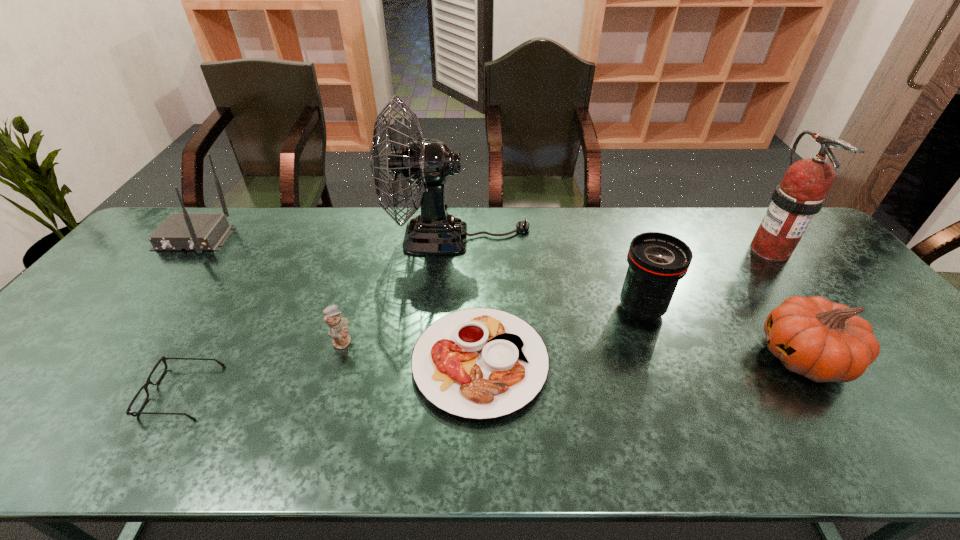
Identify the location of object that is positioned at the far right corner. Image resolution: width=960 pixels, height=540 pixels. (801, 194).

In the image, there is a desktop. Where is `free space at the far edge`? This screenshot has height=540, width=960. free space at the far edge is located at coordinates (625, 218).

Locate an element on the screen. free region at the near edge of the desktop is located at coordinates (503, 441).

Locate an element on the screen. The height and width of the screenshot is (540, 960). vacant space at the right edge of the desktop is located at coordinates (906, 410).

Locate an element on the screen. The height and width of the screenshot is (540, 960). vacant area at the far right corner is located at coordinates (818, 244).

Find the location of a particular element. Image resolution: width=960 pixels, height=540 pixels. vacant space that is in between the spectacles and the leftmost object is located at coordinates (188, 315).

Where is `vacant point located between the spectacles and the router`? The height and width of the screenshot is (540, 960). vacant point located between the spectacles and the router is located at coordinates (188, 315).

Find the location of a particular element. Image resolution: width=960 pixels, height=540 pixels. free space between the sixth object from left to right and the seventh object from right to left is located at coordinates (412, 350).

Image resolution: width=960 pixels, height=540 pixels. What are the coordinates of `vacant point located between the third object from left to right and the fourth shortest object` in the screenshot? It's located at (573, 349).

In order to click on empty space between the fan and the platter in this screenshot , I will do `click(469, 300)`.